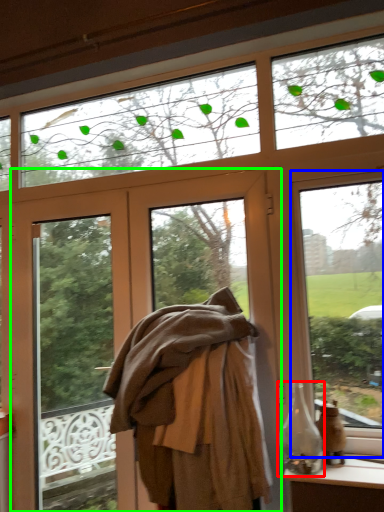
Question: Estimate the real-world distances between objects in this image. Which object is farther from bottle (highlighted by a red box), window (highlighted by a blue box) or door (highlighted by a green box)?

Choices:
 (A) window
 (B) door

Answer: (B)